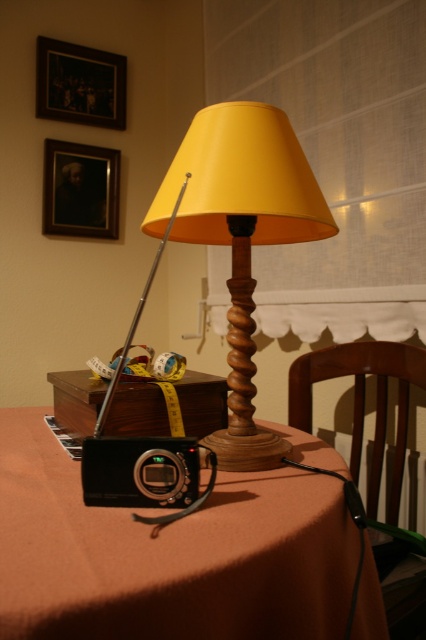
Is point (299, 216) farther from viewer compared to point (62, 160)?

No, (299, 216) is in front of (62, 160).

Which is in front, point (270, 138) or point (48, 204)?

Positioned in front is point (270, 138).

Which is behind, point (282, 189) or point (100, 179)?

Positioned behind is point (100, 179).

Where is `yellow matte wood table lamp at center`? yellow matte wood table lamp at center is located at coordinates (241, 237).

From the picture: Does wooden frame at upper left have a smaller size compared to matte black portrait at upper left?

No, wooden frame at upper left is not smaller than matte black portrait at upper left.

Consider the image. Does wooden frame at upper left appear over matte black portrait at upper left?

Yes.

The height and width of the screenshot is (640, 426). What do you see at coordinates (80, 84) in the screenshot?
I see `wooden frame at upper left` at bounding box center [80, 84].

Image resolution: width=426 pixels, height=640 pixels. In order to click on wooden frame at upper left in this screenshot , I will do `click(80, 84)`.

Does orange fabric table at lower center have a lesser width compared to matte black portrait at upper left?

In fact, orange fabric table at lower center might be wider than matte black portrait at upper left.

In the scene shown: Can you confirm if orange fabric table at lower center is taller than matte black portrait at upper left?

In fact, orange fabric table at lower center may be shorter than matte black portrait at upper left.

You are a GUI agent. You are given a task and a screenshot of the screen. Output one action in this format:
    pyautogui.click(x=<x>, y=<y>)
    Task: Click on the orange fabric table at lower center
    
    Given the screenshot: What is the action you would take?
    pyautogui.click(x=167, y=554)

At what (x,y) coordinates should I click in order to perform the action: click on orange fabric table at lower center. Please return your answer as a coordinate pair (x, y). This screenshot has height=640, width=426. Looking at the image, I should click on (167, 554).